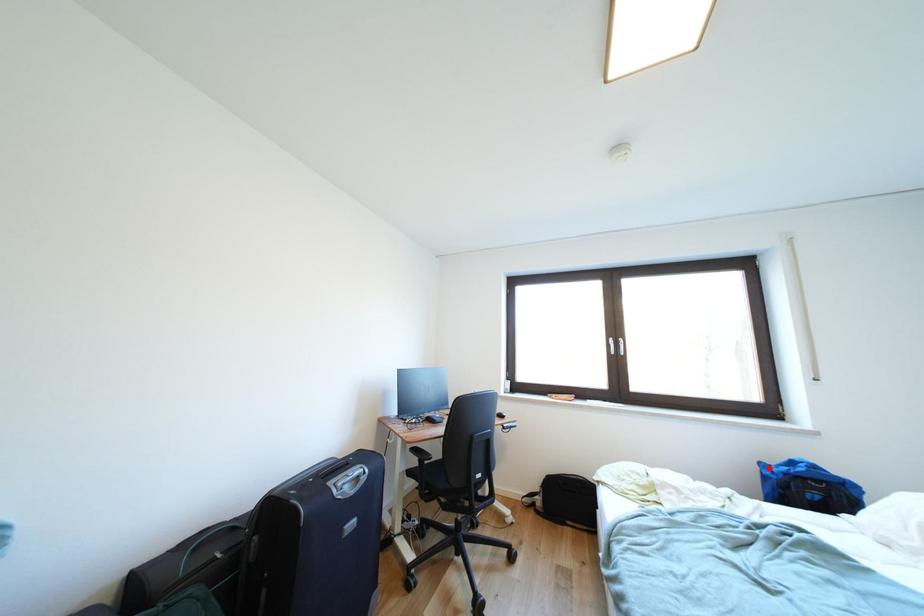
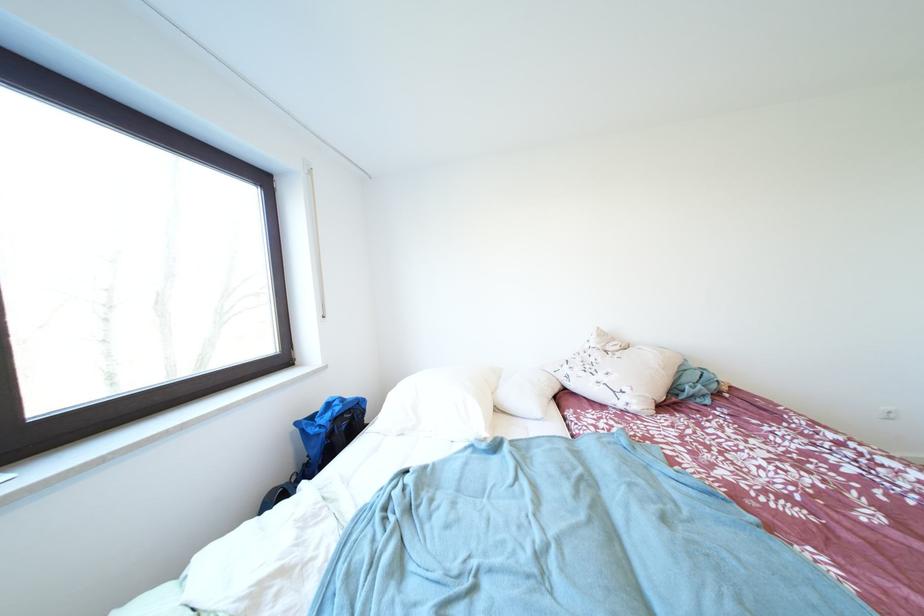
Find the pixel in the second image that matches the highlighted location in the first image.

(305, 428)